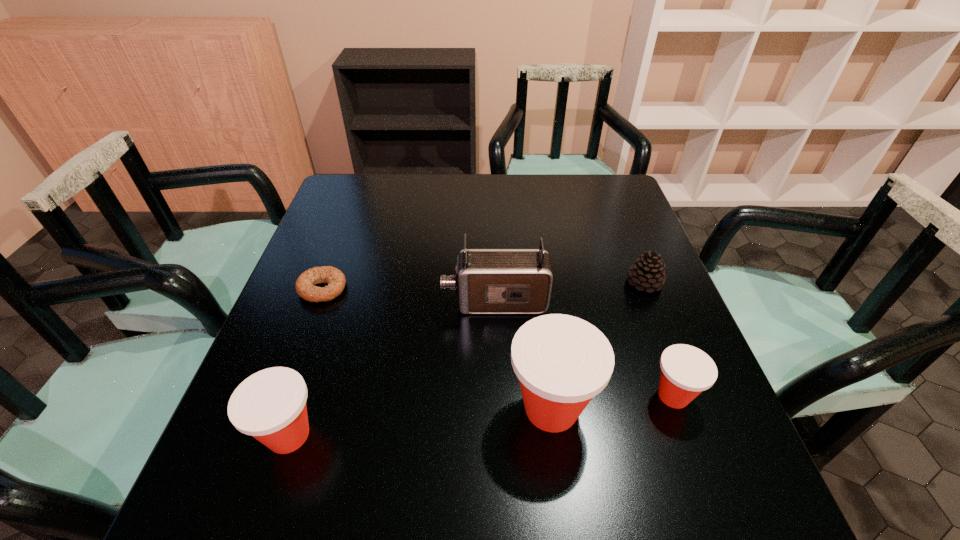
To achieve even spacing by inserting another Dixie_cup among them, please point to a vacant spot for this new Dixie_cup. Please provide its 2D coordinates. Your answer should be formatted as a tuple, i.e. [(x, y)], where the tuple contains the x and y coordinates of a point satisfying the conditions above.

[(423, 421)]